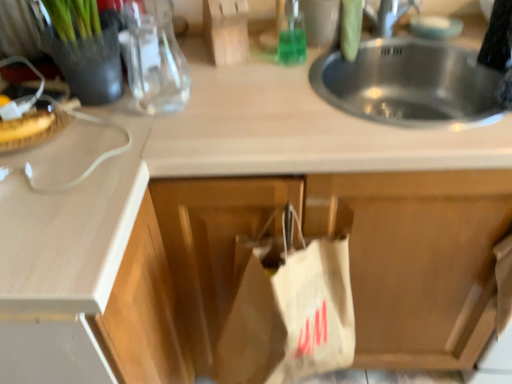
Image resolution: width=512 pixels, height=384 pixels. In order to click on free location to the left of green glass bottle at upper center, the 1th bottle viewed from the right in this screenshot , I will do `click(230, 71)`.